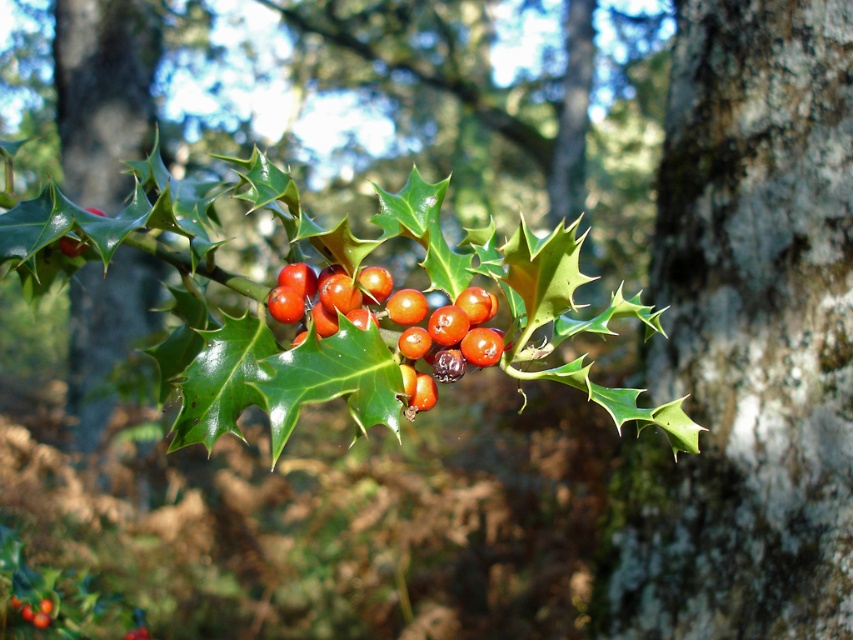
Question: Which object is positioned farthest from the smooth bark tree trunk at left?

Choices:
 (A) glossy red berries at center
 (B) smooth gray bark at center

Answer: (A)

Question: Is smooth gray bark at center to the right of smooth bark tree trunk at left from the viewer's perspective?

Choices:
 (A) yes
 (B) no

Answer: (A)

Question: Does smooth gray bark at center appear under smooth bark tree trunk at left?

Choices:
 (A) no
 (B) yes

Answer: (B)

Question: Which point is closer to the camera?

Choices:
 (A) (440, 353)
 (B) (144, 284)
 (C) (721, 493)

Answer: (A)

Question: Does smooth bark tree trunk at left lie in front of glossy red berries at center?

Choices:
 (A) no
 (B) yes

Answer: (A)

Question: Which point is closer to the camera?

Choices:
 (A) (70, 141)
 (B) (787, 436)

Answer: (B)